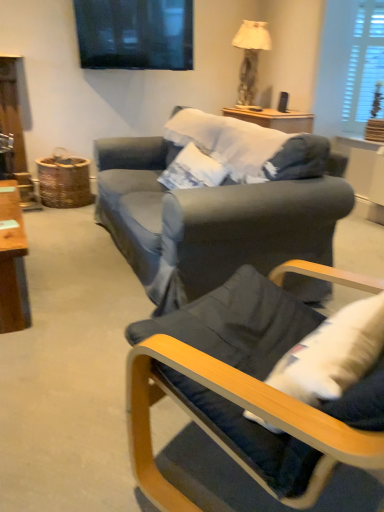
Question: Does white wooden blinds at upper right contain matte beige lampshade at upper right?

Choices:
 (A) no
 (B) yes

Answer: (A)

Question: Can you confirm if white wooden blinds at upper right is wider than matte beige lampshade at upper right?

Choices:
 (A) no
 (B) yes

Answer: (A)

Question: Can you confirm if white wooden blinds at upper right is smaller than matte beige lampshade at upper right?

Choices:
 (A) yes
 (B) no

Answer: (A)

Question: Can you confirm if white wooden blinds at upper right is shorter than matte beige lampshade at upper right?

Choices:
 (A) no
 (B) yes

Answer: (A)

Question: Can we say white wooden blinds at upper right lies outside matte beige lampshade at upper right?

Choices:
 (A) no
 (B) yes

Answer: (B)

Question: Is dark blue fabric chair at lower right wider or thinner than white wooden blinds at upper right?

Choices:
 (A) wide
 (B) thin

Answer: (A)

Question: Visually, is dark blue fabric chair at lower right positioned to the left or to the right of white wooden blinds at upper right?

Choices:
 (A) left
 (B) right

Answer: (A)

Question: From their relative heights in the image, would you say dark blue fabric chair at lower right is taller or shorter than white wooden blinds at upper right?

Choices:
 (A) tall
 (B) short

Answer: (B)

Question: Is point (226, 281) closer or farther from the camera than point (367, 77)?

Choices:
 (A) closer
 (B) farther

Answer: (A)

Question: Is white wooden blinds at upper right wider or thinner than dark blue fabric chair at lower right?

Choices:
 (A) wide
 (B) thin

Answer: (B)

Question: From a real-world perspective, is white wooden blinds at upper right physically located above or below dark blue fabric chair at lower right?

Choices:
 (A) below
 (B) above

Answer: (B)

Question: Is white wooden blinds at upper right inside the boundaries of dark blue fabric chair at lower right, or outside?

Choices:
 (A) inside
 (B) outside

Answer: (B)

Question: Is white wooden blinds at upper right in front of or behind dark blue fabric chair at lower right in the image?

Choices:
 (A) behind
 (B) front

Answer: (A)

Question: In terms of height, does dark blue fabric chair at lower right look taller or shorter compared to matte beige lampshade at upper right?

Choices:
 (A) short
 (B) tall

Answer: (A)

Question: From a real-world perspective, is dark blue fabric chair at lower right above or below matte beige lampshade at upper right?

Choices:
 (A) below
 (B) above

Answer: (A)